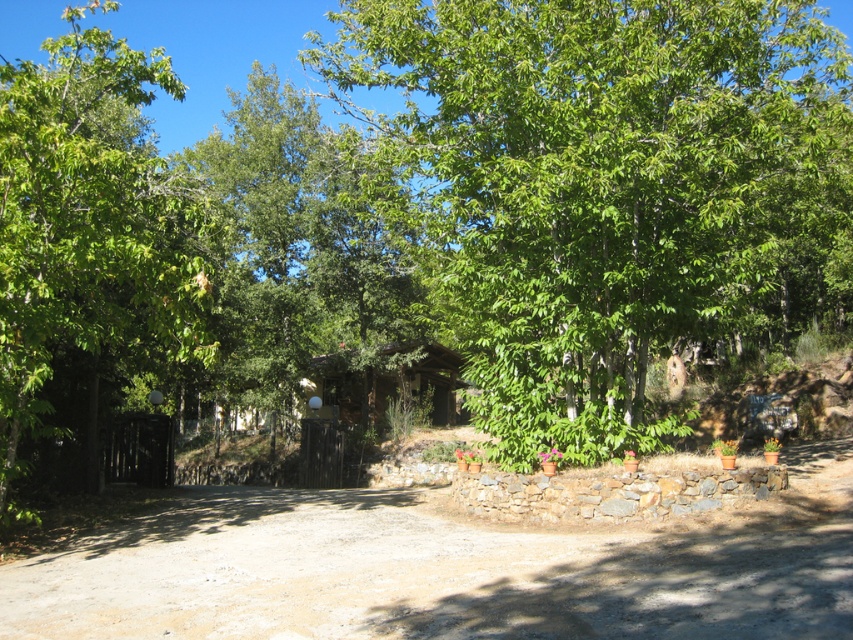
You are a hiker standing on the dirt path in the scene. You want to take a photo of both the green leafy tree at center and the green leafy tree at left. Which tree should you position yourself closer to in order to capture both in the same frame?

You should position yourself closer to the green leafy tree at center because it is located below the green leafy tree at left, so adjusting your position to be nearer to the lower tree will help include both in the frame.

You are standing at the point with coordinates [605,188] in the image. What object are you located on?

The point with coordinates [605,188] is located on the green leafy tree at center.